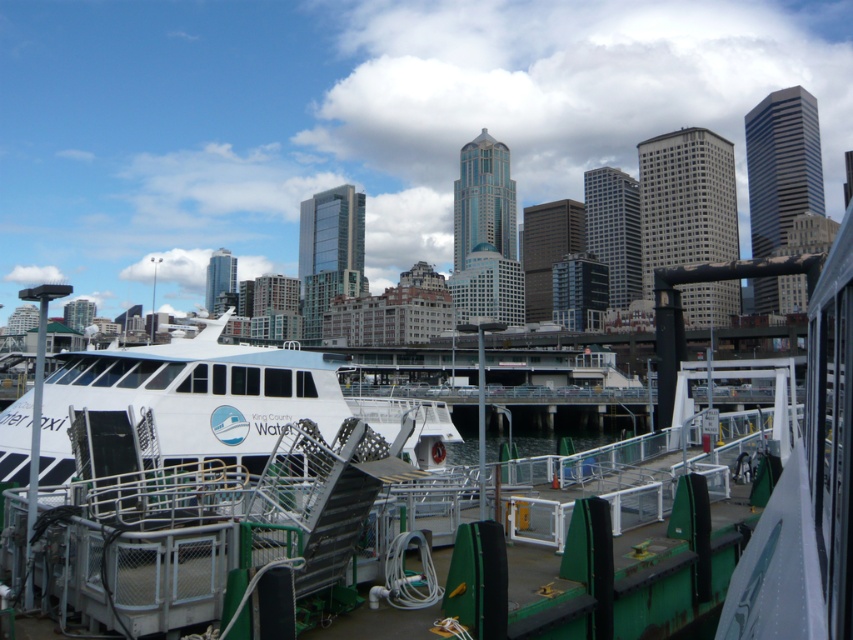
You are a delivery drone that needs to drop off a package to the white glossy ferry at center. The drone can only hover at a maximum height of 20 meters. Can you safely hover over the clear water at dock center to deliver the package without exceeding the height limit?

The distance between the white glossy ferry at center and the clear water at dock center is 21.01 meters. Since the drone can only hover up to 20 meters, it cannot safely hover over the clear water at dock center to deliver the package without exceeding the height limit.

You are a passenger on the ferry and want to disembark. The ferry is at the point labeled as point (198, 401). The ferry is docked at a pier with green and white railings. Where should you go to exit the ferry?

The point labeled (198, 401) indicates the white glossy ferry at center, so you should go to the pier with green and white railings to exit the ferry.

You are a photographer standing on the pier at the ferry terminal. You want to capture a photo of the white glossy ferry at center and the clear water at dock center. Based on their positions, which object will appear closer to the camera in the photo?

The white glossy ferry at center will appear closer to the camera in the photo because it is positioned in front of the clear water at dock center.